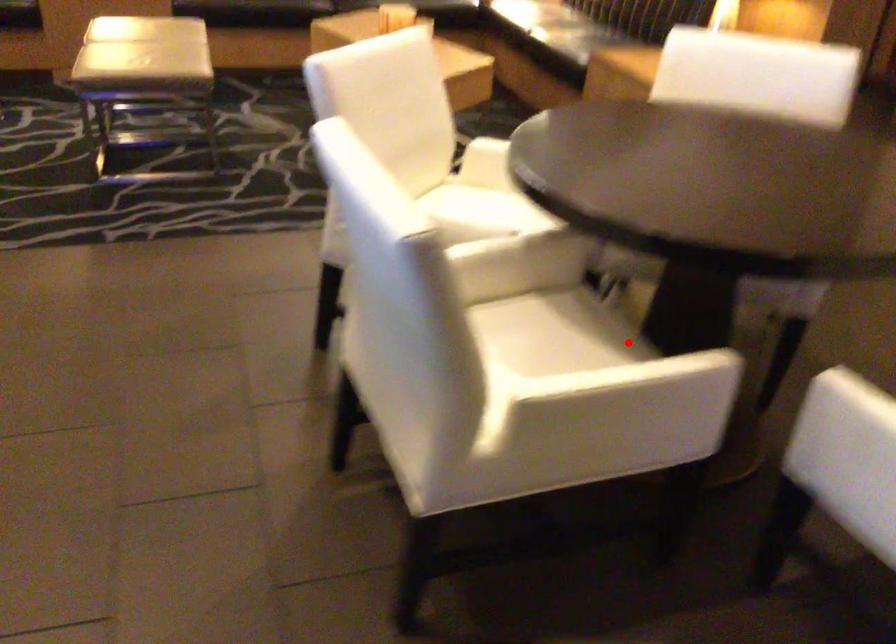
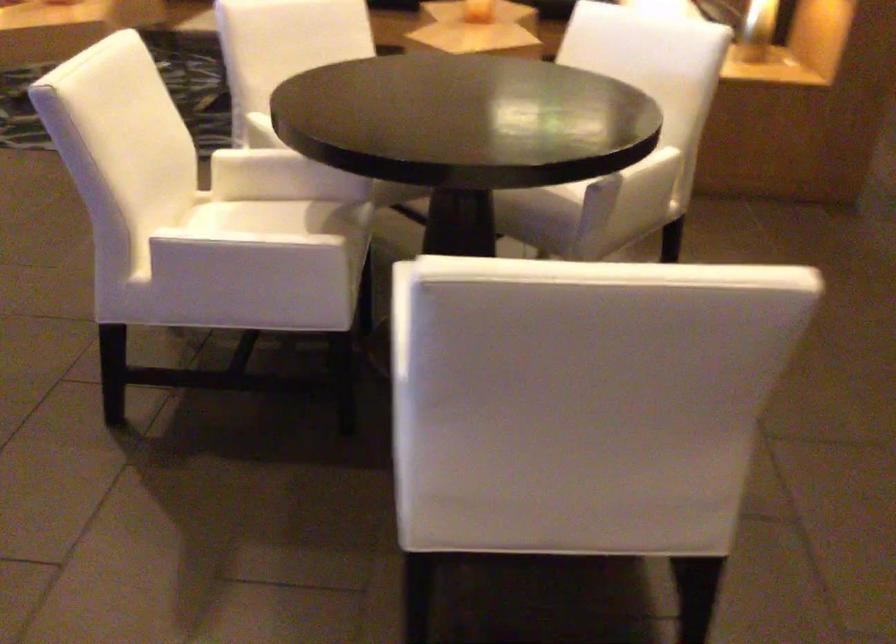
Question: I am providing you with two images of the same scene from different viewpoints. In image1, a red point is highlighted. Considering the same 3D point in image2, which of the following is correct?

Choices:
 (A) It is closer
 (B) It is farther

Answer: (B)